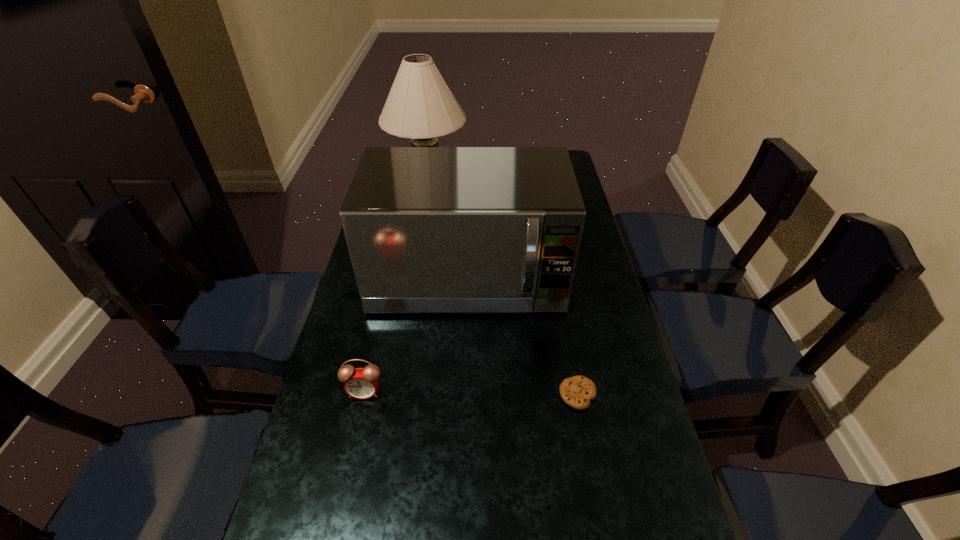
In order to click on object at the far edge in this screenshot , I will do `click(420, 105)`.

The width and height of the screenshot is (960, 540). Find the location of `lampshade present at the left edge`. lampshade present at the left edge is located at coordinates (420, 105).

The image size is (960, 540). Find the location of `microwave oven at the left edge`. microwave oven at the left edge is located at coordinates (429, 229).

The width and height of the screenshot is (960, 540). I want to click on alarm clock present at the left edge, so click(x=361, y=383).

Locate an element on the screen. The height and width of the screenshot is (540, 960). microwave oven at the right edge is located at coordinates (429, 229).

The width and height of the screenshot is (960, 540). I want to click on cookie at the right edge, so click(577, 391).

Identify the location of object located at the far left corner. (420, 105).

You are a GUI agent. You are given a task and a screenshot of the screen. Output one action in this format:
    pyautogui.click(x=<x>, y=<y>)
    Task: Click on the vacant region at the left edge of the desktop
    Image resolution: width=960 pixels, height=540 pixels.
    Given the screenshot: What is the action you would take?
    pyautogui.click(x=319, y=521)

Identify the location of vacant position at the right edge of the desktop. (586, 245).

I want to click on vacant area that lies between the cookie and the alarm clock, so click(x=471, y=393).